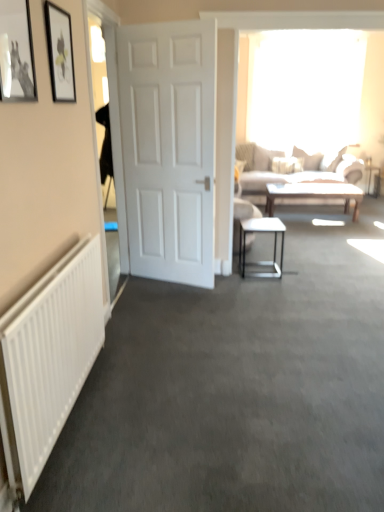
Question: Considering their positions, is white glossy door at left located in front of or behind light brown wooden coffee table at center?

Choices:
 (A) front
 (B) behind

Answer: (A)

Question: Considering the relative positions of white glossy door at left and light brown wooden coffee table at center in the image provided, is white glossy door at left to the left or to the right of light brown wooden coffee table at center?

Choices:
 (A) right
 (B) left

Answer: (B)

Question: Which is nearer to the transparent glass window at upper center?

Choices:
 (A) white matte door at center
 (B) light beige fabric couch at upper right
 (C) light brown wooden coffee table at center
 (D) matte black picture frame at upper left, the 2th picture frame when ordered from front to back
 (E) metallic silver picture frame at upper left, which is the 1th picture frame from front to back

Answer: (B)

Question: Estimate the real-world distances between objects in this image. Which object is farther from the transparent glass window at upper center?

Choices:
 (A) metallic silver picture frame at upper left, which is the 1th picture frame from front to back
 (B) white matte door at center
 (C) white matte radiator at left
 (D) light brown wooden coffee table at center
 (E) metallic silver table at center

Answer: (A)